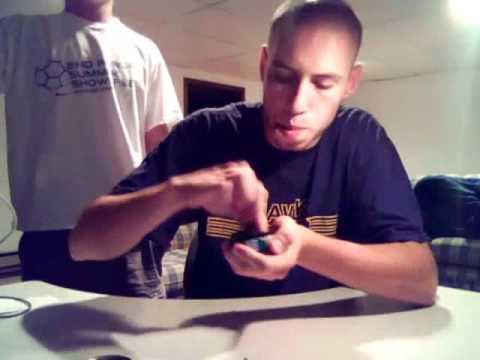
Identify the location of light source. This screenshot has width=480, height=360. (468, 13).